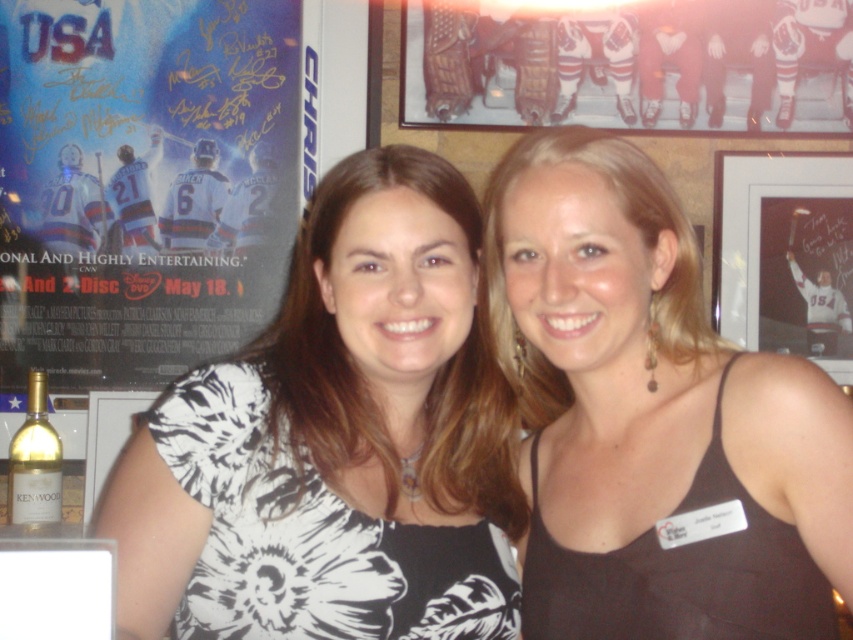
Question: Which of the following is the closest to the observer?

Choices:
 (A) (27, 438)
 (B) (817, 170)
 (C) (689, 460)

Answer: (C)

Question: Which object is positioned closest to the metallic silver hockey players at upper center?

Choices:
 (A) gold metallic bottle at lower left
 (B) matte black frame at upper right
 (C) white floral dress at center
 (D) white glossy poster at upper left

Answer: (B)

Question: Does black fabric tank top at center appear over white glossy poster at upper left?

Choices:
 (A) no
 (B) yes

Answer: (A)

Question: Can you confirm if white floral dress at center is positioned above black fabric tank top at center?

Choices:
 (A) yes
 (B) no

Answer: (B)

Question: Is white floral dress at center positioned before metallic silver hockey players at upper center?

Choices:
 (A) yes
 (B) no

Answer: (A)

Question: Estimate the real-world distances between objects in this image. Which object is farther from the white glossy poster at upper left?

Choices:
 (A) black fabric tank top at center
 (B) gold metallic bottle at lower left
 (C) metallic silver hockey players at upper center

Answer: (A)